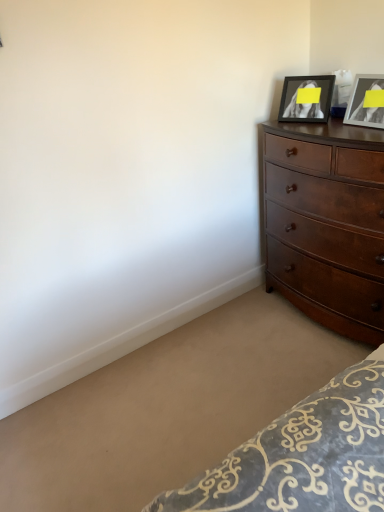
Question: Is the position of matte black picture frame at upper right, marked as the 1th picture frame in a left-to-right arrangement, less distant than that of matte black picture frame at upper right, the second picture frame positioned from the left?

Choices:
 (A) no
 (B) yes

Answer: (A)

Question: From the image's perspective, does matte black picture frame at upper right, which is the 2th picture frame in right-to-left order, appear lower than matte black picture frame at upper right, marked as the first picture frame in a right-to-left arrangement?

Choices:
 (A) yes
 (B) no

Answer: (B)

Question: Is matte black picture frame at upper right, which is the 2th picture frame in right-to-left order, facing away from matte black picture frame at upper right, the second picture frame positioned from the left?

Choices:
 (A) no
 (B) yes

Answer: (A)

Question: Is matte black picture frame at upper right, which is the 2th picture frame in right-to-left order, taller than matte black picture frame at upper right, the second picture frame positioned from the left?

Choices:
 (A) yes
 (B) no

Answer: (B)

Question: Can you confirm if matte black picture frame at upper right, which is the 2th picture frame in right-to-left order, is bigger than matte black picture frame at upper right, the second picture frame positioned from the left?

Choices:
 (A) no
 (B) yes

Answer: (B)

Question: Considering the relative sizes of matte black picture frame at upper right, which is the 2th picture frame in right-to-left order, and matte black picture frame at upper right, marked as the first picture frame in a right-to-left arrangement, in the image provided, is matte black picture frame at upper right, which is the 2th picture frame in right-to-left order, thinner than matte black picture frame at upper right, marked as the first picture frame in a right-to-left arrangement,?

Choices:
 (A) yes
 (B) no

Answer: (B)

Question: Does matte black picture frame at upper right, which is the 2th picture frame in right-to-left order, lie in front of dark brown wood dresser at right?

Choices:
 (A) yes
 (B) no

Answer: (B)

Question: Is matte black picture frame at upper right, marked as the 1th picture frame in a left-to-right arrangement, surrounding dark brown wood dresser at right?

Choices:
 (A) yes
 (B) no

Answer: (B)

Question: Is matte black picture frame at upper right, marked as the 1th picture frame in a left-to-right arrangement, bigger than dark brown wood dresser at right?

Choices:
 (A) yes
 (B) no

Answer: (B)

Question: Does matte black picture frame at upper right, which is the 2th picture frame in right-to-left order, have a lesser height compared to dark brown wood dresser at right?

Choices:
 (A) no
 (B) yes

Answer: (B)

Question: Does matte black picture frame at upper right, which is the 2th picture frame in right-to-left order, have a smaller size compared to dark brown wood dresser at right?

Choices:
 (A) yes
 (B) no

Answer: (A)

Question: Is matte black picture frame at upper right, marked as the 1th picture frame in a left-to-right arrangement, to the right of dark brown wood dresser at right from the viewer's perspective?

Choices:
 (A) yes
 (B) no

Answer: (B)

Question: From a real-world perspective, is dark brown wood dresser at right on matte black picture frame at upper right, the second picture frame positioned from the left?

Choices:
 (A) yes
 (B) no

Answer: (B)